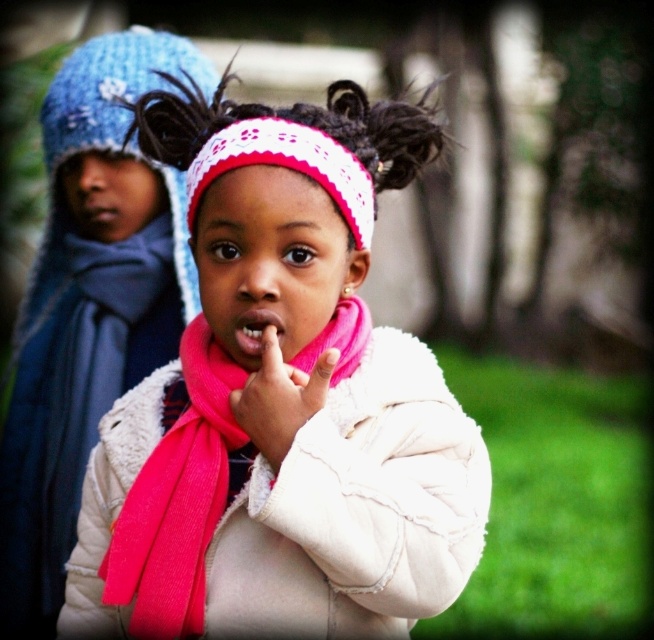
You are a photographer trying to capture the girl in the pink fleece jacket at center and pink fleece scarf at upper center. To ensure both items are in focus, which one should you focus on first based on their positions?

The pink fleece jacket at center is below the pink fleece scarf at upper center, so focusing on the pink fleece jacket at center first would ensure both are in focus as the scarf is closer to the camera.

You are a photographer trying to capture the exact position of the pink fabric scarf at center in the image. According to the coordinates provided, where should you focus your camera lens to ensure the scarf is centered in your shot?

To center the pink fabric scarf at center in the shot, focus your camera lens at the coordinates point (177,500) as the scarf is positioned there.

You are a photographer trying to capture the pink fleece jacket at center in the image. What are the coordinates where you should focus your camera?

The pink fleece jacket at center is located at coordinates point (281, 403), so focus there.